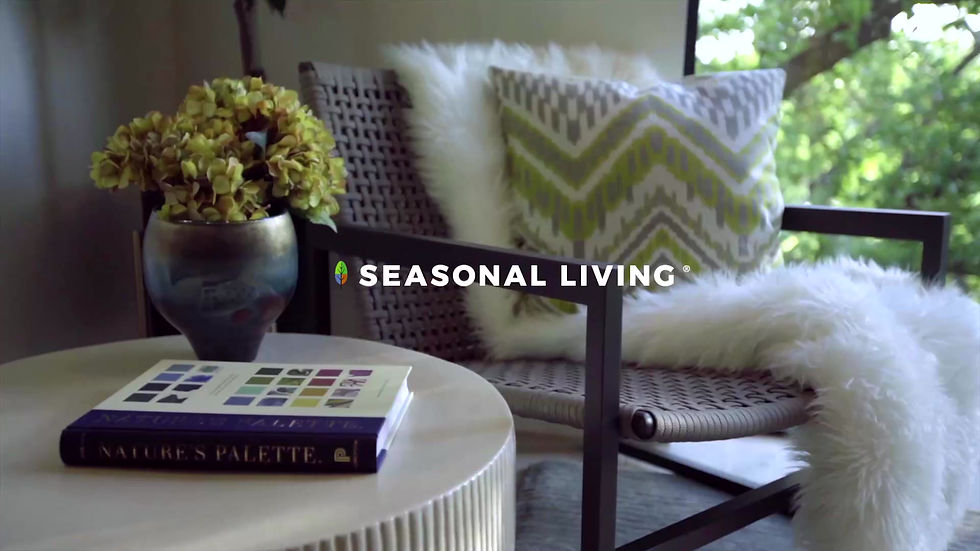
I want to click on table, so (x=193, y=525).